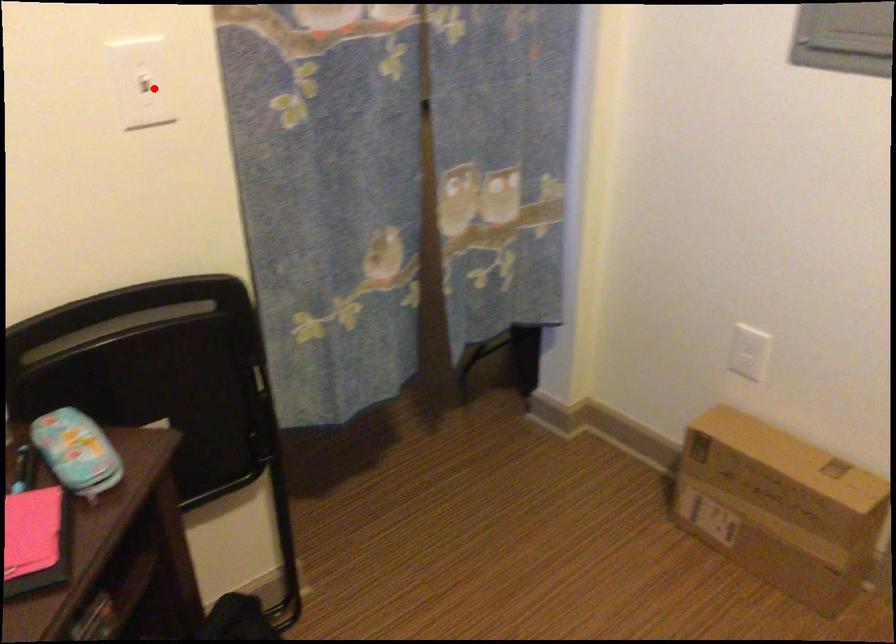
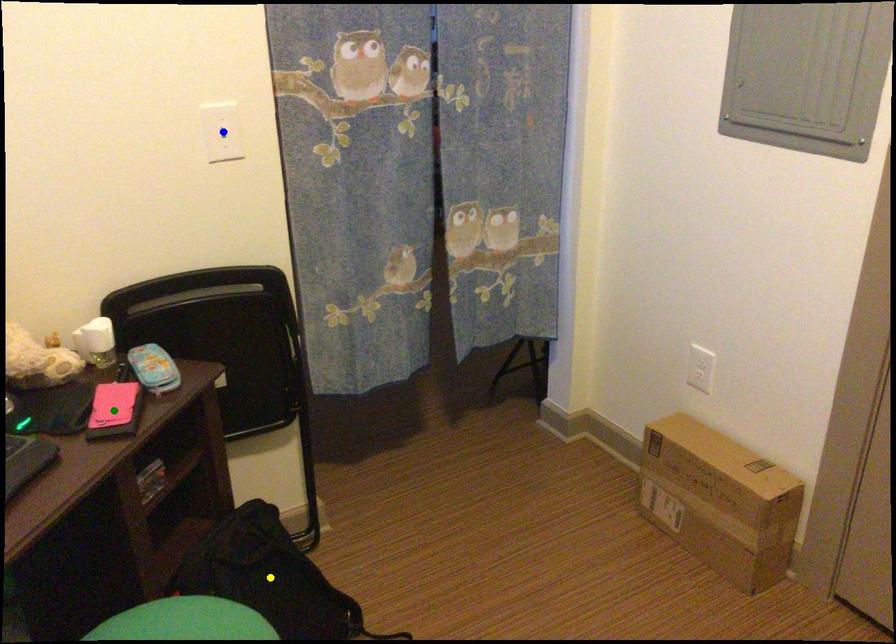
Question: I am providing you with two images of the same scene from different viewpoints. A red point is marked on the first image. You are given multiple points on the second image. Which mark in image 2 goes with the point in image 1?

Choices:
 (A) green point
 (B) yellow point
 (C) blue point

Answer: (C)